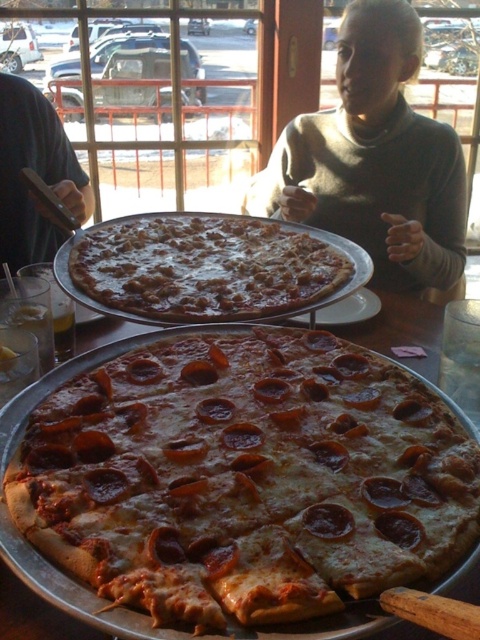
Between cheesy pepperoni pizza at center and slightly browned cheese pizza at center, which one appears on the left side from the viewer's perspective?

slightly browned cheese pizza at center is more to the left.

From the picture: Which is more to the right, cheesy pepperoni pizza at center or slightly browned cheese pizza at center?

From the viewer's perspective, cheesy pepperoni pizza at center appears more on the right side.

Which is behind, point (360, 524) or point (255, 300)?

The point (255, 300) is more distant.

Find the location of a particular element. This screenshot has height=640, width=480. cheesy pepperoni pizza at center is located at coordinates (23, 436).